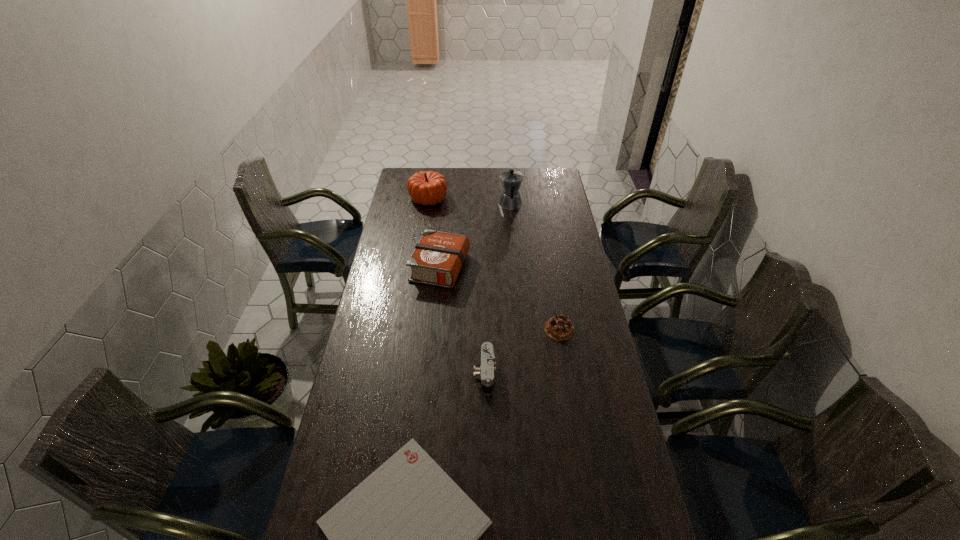
The image size is (960, 540). I want to click on the second closest object to the coffeepot, so click(437, 259).

Locate which object is the closest to the Bible. Please provide its 2D coordinates. Your answer should be formatted as a tuple, i.e. [(x, y)], where the tuple contains the x and y coordinates of a point satisfying the conditions above.

[(511, 180)]

The width and height of the screenshot is (960, 540). What are the coordinates of `vacant area in the image that satisfies the following two spatial constraints: 1. on the front side of the Bible; 2. on the left side of the pumpkin` in the screenshot? It's located at (418, 267).